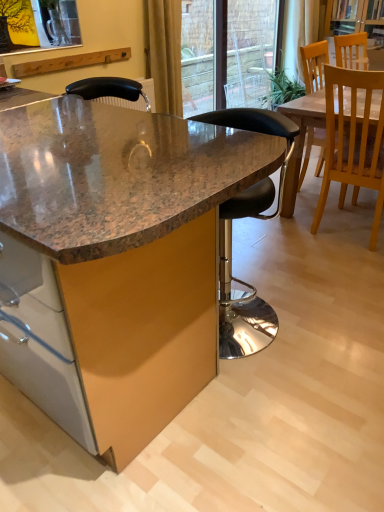
Where is `wooden chair at upper right, which is the 1th chair from right to left`? The height and width of the screenshot is (512, 384). wooden chair at upper right, which is the 1th chair from right to left is located at coordinates (351, 51).

The height and width of the screenshot is (512, 384). Describe the element at coordinates (298, 34) in the screenshot. I see `white sheer curtain at upper center, placed as the 1th curtain when sorted from right to left` at that location.

Find the location of `transparent glass door at upper center`. transparent glass door at upper center is located at coordinates (227, 53).

I want to click on yellow fabric curtain at upper center, positioned as the first curtain in bottom-to-top order, so click(x=166, y=54).

Is yellow fabric curtain at upper center, the 1th curtain viewed from the left, next to white sheer curtain at upper center, the second curtain when ordered from bottom to top?

No.

Could white sheer curtain at upper center, arranged as the 1th curtain when viewed from the back, be considered to be inside yellow fabric curtain at upper center, the 1th curtain viewed from the left?

That's incorrect, white sheer curtain at upper center, arranged as the 1th curtain when viewed from the back, is not inside yellow fabric curtain at upper center, the 1th curtain viewed from the left.

From a real-world perspective, is yellow fabric curtain at upper center, which is counted as the 2th curtain, starting from the back, positioned above or below white sheer curtain at upper center, the first curtain when ordered from top to bottom?

yellow fabric curtain at upper center, which is counted as the 2th curtain, starting from the back, is above white sheer curtain at upper center, the first curtain when ordered from top to bottom.

Does yellow fabric curtain at upper center, which is the second curtain in top-to-bottom order, come behind white sheer curtain at upper center, the second curtain when ordered from bottom to top?

No, yellow fabric curtain at upper center, which is the second curtain in top-to-bottom order, is closer to the viewer.

From the image's perspective, is white sheer curtain at upper center, placed as the second curtain when sorted from front to back, below yellow fabric curtain at upper center, positioned as the first curtain in bottom-to-top order?

Incorrect, from the image's perspective, white sheer curtain at upper center, placed as the second curtain when sorted from front to back, is higher than yellow fabric curtain at upper center, positioned as the first curtain in bottom-to-top order.

Considering the positions of objects white sheer curtain at upper center, arranged as the 1th curtain when viewed from the back, and yellow fabric curtain at upper center, positioned as the first curtain in bottom-to-top order, in the image provided, who is behind, white sheer curtain at upper center, arranged as the 1th curtain when viewed from the back, or yellow fabric curtain at upper center, positioned as the first curtain in bottom-to-top order,?

white sheer curtain at upper center, arranged as the 1th curtain when viewed from the back, is further away from the camera.

Considering the relative sizes of white sheer curtain at upper center, the first curtain when ordered from top to bottom, and yellow fabric curtain at upper center, which is the second curtain in top-to-bottom order, in the image provided, is white sheer curtain at upper center, the first curtain when ordered from top to bottom, shorter than yellow fabric curtain at upper center, which is the second curtain in top-to-bottom order,?

Correct, white sheer curtain at upper center, the first curtain when ordered from top to bottom, is not as tall as yellow fabric curtain at upper center, which is the second curtain in top-to-bottom order.

Consider the image. Considering the positions of objects granite table at center and yellow fabric curtain at upper center, positioned as the first curtain in bottom-to-top order, in the image provided, who is more to the right, granite table at center or yellow fabric curtain at upper center, positioned as the first curtain in bottom-to-top order,?

yellow fabric curtain at upper center, positioned as the first curtain in bottom-to-top order, is more to the right.

Are granite table at center and yellow fabric curtain at upper center, marked as the 2th curtain in a right-to-left arrangement, far apart?

Yes, granite table at center and yellow fabric curtain at upper center, marked as the 2th curtain in a right-to-left arrangement, are located far from each other.

From a real-world perspective, who is located higher, granite table at center or yellow fabric curtain at upper center, marked as the 2th curtain in a right-to-left arrangement?

yellow fabric curtain at upper center, marked as the 2th curtain in a right-to-left arrangement, from a real-world perspective.

From their relative heights in the image, would you say granite table at center is taller or shorter than yellow fabric curtain at upper center, which is the second curtain in top-to-bottom order?

granite table at center is taller than yellow fabric curtain at upper center, which is the second curtain in top-to-bottom order.

From a real-world perspective, is light wood chair at right, which appears as the second chair when viewed from the left, located beneath white sheer curtain at upper center, positioned as the 2th curtain in left-to-right order?

Yes.

Is light wood chair at right, the second chair in the right-to-left sequence, facing away from white sheer curtain at upper center, positioned as the 2th curtain in left-to-right order?

No, light wood chair at right, the second chair in the right-to-left sequence, is not facing the opposite direction of white sheer curtain at upper center, positioned as the 2th curtain in left-to-right order.

Considering the positions of objects light wood chair at right, which appears as the second chair when viewed from the left, and white sheer curtain at upper center, arranged as the 1th curtain when viewed from the back, in the image provided, who is more to the right, light wood chair at right, which appears as the second chair when viewed from the left, or white sheer curtain at upper center, arranged as the 1th curtain when viewed from the back,?

From the viewer's perspective, white sheer curtain at upper center, arranged as the 1th curtain when viewed from the back, appears more on the right side.

Between light wood chair at right, the second chair in the right-to-left sequence, and white sheer curtain at upper center, placed as the second curtain when sorted from front to back, which one has larger size?

With larger size is light wood chair at right, the second chair in the right-to-left sequence.

Can you confirm if white sheer curtain at upper center, placed as the second curtain when sorted from front to back, is shorter than transparent glass door at upper center?

Indeed, white sheer curtain at upper center, placed as the second curtain when sorted from front to back, has a lesser height compared to transparent glass door at upper center.

Is white sheer curtain at upper center, positioned as the 2th curtain in left-to-right order, facing towards transparent glass door at upper center?

No, white sheer curtain at upper center, positioned as the 2th curtain in left-to-right order, is not turned towards transparent glass door at upper center.

Does white sheer curtain at upper center, placed as the second curtain when sorted from front to back, come behind transparent glass door at upper center?

Yes, it is behind transparent glass door at upper center.

Image resolution: width=384 pixels, height=512 pixels. What are the coordinates of `the 2nd curtain positioned above the light wood chair at right, the second chair in the right-to-left sequence (from the image's perspective)` in the screenshot? It's located at (298, 34).

How different are the orientations of white sheer curtain at upper center, placed as the 1th curtain when sorted from right to left, and light wood chair at right, the second chair in the right-to-left sequence, in degrees?

95.5 degrees.

Are white sheer curtain at upper center, the first curtain when ordered from top to bottom, and light wood chair at right, which appears as the second chair when viewed from the left, far apart?

Indeed, white sheer curtain at upper center, the first curtain when ordered from top to bottom, is not near light wood chair at right, which appears as the second chair when viewed from the left.

Considering the sizes of objects white sheer curtain at upper center, arranged as the 1th curtain when viewed from the back, and light wood chair at right, the second chair in the right-to-left sequence, in the image provided, who is thinner, white sheer curtain at upper center, arranged as the 1th curtain when viewed from the back, or light wood chair at right, the second chair in the right-to-left sequence,?

white sheer curtain at upper center, arranged as the 1th curtain when viewed from the back.

Which is correct: transparent glass door at upper center is inside granite table at center, or outside of it?

transparent glass door at upper center is located beyond the bounds of granite table at center.

Between transparent glass door at upper center and granite table at center, which one appears on the left side from the viewer's perspective?

Positioned to the left is granite table at center.

From a real-world perspective, which object stands above the other?

transparent glass door at upper center, from a real-world perspective.

Identify the location of curtain that appears above the white sheer curtain at upper center, positioned as the 2th curtain in left-to-right order (from a real-world perspective). This screenshot has width=384, height=512. (166, 54).

Find the location of a particular element. curtain on the right of yellow fabric curtain at upper center, which is the 1th curtain in front-to-back order is located at coordinates (298, 34).

Looking at the image, which one is located closer to granite table at center, transparent glass door at upper center or light wood chair at right, the second chair in the right-to-left sequence?

Based on the image, light wood chair at right, the second chair in the right-to-left sequence, appears to be nearer to granite table at center.

Estimate the real-world distances between objects in this image. Which object is further from black leather stool at center, the 1th chair viewed from the left, transparent glass door at upper center or yellow fabric curtain at upper center, which is the 1th curtain in front-to-back order?

transparent glass door at upper center is positioned further to the anchor black leather stool at center, the 1th chair viewed from the left.

Based on their spatial positions, is yellow fabric curtain at upper center, which is the second curtain in top-to-bottom order, or white sheer curtain at upper center, positioned as the 2th curtain in left-to-right order, closer to black leather stool at center, the 1th chair viewed from the left?

The object closer to black leather stool at center, the 1th chair viewed from the left, is yellow fabric curtain at upper center, which is the second curtain in top-to-bottom order.

Looking at the image, which one is located further to granite table at center, white sheer curtain at upper center, the second curtain when ordered from bottom to top, or light wood chair at right, which appears as the second chair when viewed from the left?

The object further to granite table at center is white sheer curtain at upper center, the second curtain when ordered from bottom to top.

Looking at the image, which one is located closer to white sheer curtain at upper center, placed as the 1th curtain when sorted from right to left, wooden chair at upper right, positioned as the 3th chair in left-to-right order, or yellow fabric curtain at upper center, positioned as the first curtain in bottom-to-top order?

wooden chair at upper right, positioned as the 3th chair in left-to-right order, lies closer to white sheer curtain at upper center, placed as the 1th curtain when sorted from right to left, than the other object.

Based on their spatial positions, is granite table at center or wooden chair at upper right, positioned as the 3th chair in left-to-right order, further from white sheer curtain at upper center, the first curtain when ordered from top to bottom?

granite table at center is positioned further to the anchor white sheer curtain at upper center, the first curtain when ordered from top to bottom.

From the image, which object appears to be nearer to black leather stool at center, positioned as the 3th chair in right-to-left order, yellow fabric curtain at upper center, which is the 1th curtain in front-to-back order, or transparent glass door at upper center?

yellow fabric curtain at upper center, which is the 1th curtain in front-to-back order, is closer to black leather stool at center, positioned as the 3th chair in right-to-left order.

Looking at the image, which one is located closer to white sheer curtain at upper center, arranged as the 1th curtain when viewed from the back, granite table at center or black leather stool at center, positioned as the 3th chair in right-to-left order?

black leather stool at center, positioned as the 3th chair in right-to-left order, is positioned closer to the anchor white sheer curtain at upper center, arranged as the 1th curtain when viewed from the back.

This screenshot has width=384, height=512. I want to click on chair between granite table at center and light wood chair at right, the second chair in the right-to-left sequence, in the horizontal direction, so (231, 238).

Identify the location of curtain between yellow fabric curtain at upper center, positioned as the first curtain in bottom-to-top order, and wooden chair at upper right, positioned as the 3th chair in left-to-right order. (298, 34).

Where is `chair between black leather stool at center, the 1th chair viewed from the left, and wooden chair at upper right, which is the 1th chair from right to left, in the front-back direction`? The height and width of the screenshot is (512, 384). chair between black leather stool at center, the 1th chair viewed from the left, and wooden chair at upper right, which is the 1th chair from right to left, in the front-back direction is located at coordinates (353, 142).

Where is `curtain between black leather stool at center, the 1th chair viewed from the left, and white sheer curtain at upper center, positioned as the 2th curtain in left-to-right order, along the z-axis`? The height and width of the screenshot is (512, 384). curtain between black leather stool at center, the 1th chair viewed from the left, and white sheer curtain at upper center, positioned as the 2th curtain in left-to-right order, along the z-axis is located at coordinates (166, 54).